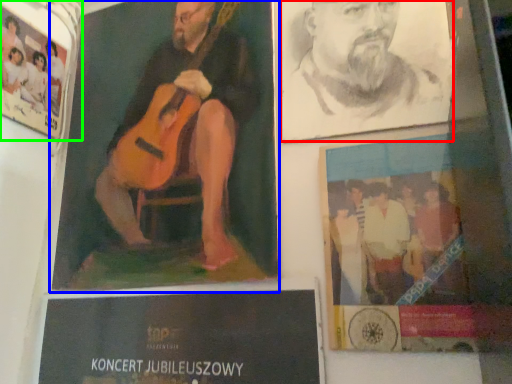
Question: Which object is positioned farthest from man (highlighted by a red box)? Select from poster (highlighted by a blue box) and poster (highlighted by a green box).

Choices:
 (A) poster
 (B) poster

Answer: (B)